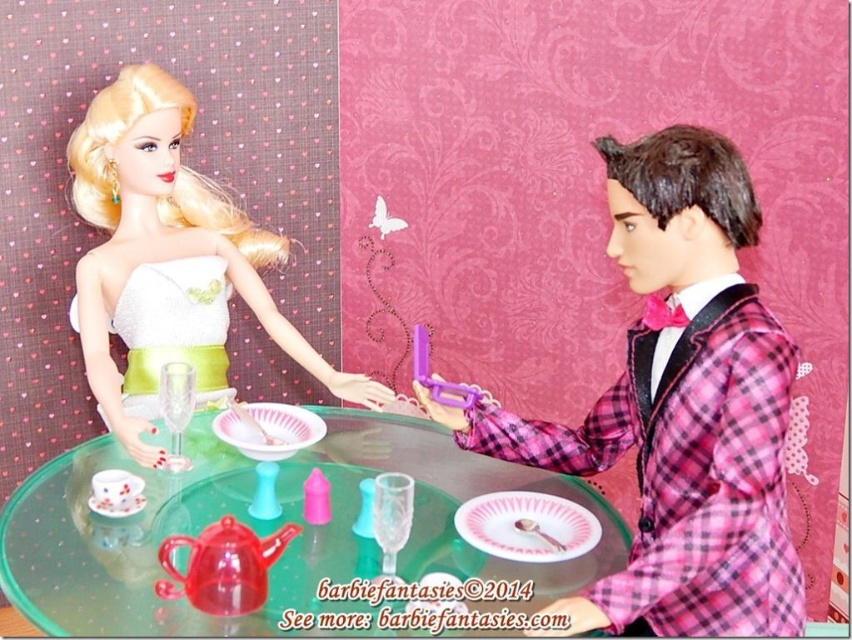
You are a toy maker inspecting a dollhouse scene. You notice the matte white dress at upper left and the transparent glass table at center. Which object has a smaller width when viewed from above?

The matte white dress at upper left is thinner than the transparent glass table at center, so the matte white dress at upper left has a smaller width when viewed from above.

You are a small toy measuring 10 inches in length that needs to be placed between the transparent glass table at center and the white satin dress at upper left. Will the toy fit in the space between them?

The distance between the transparent glass table at center and the white satin dress at upper left is 16.30 inches, so the toy, which is 10 inches long, will fit comfortably in the space between them.